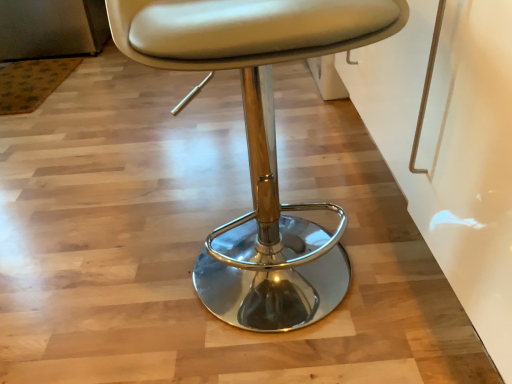
Measure the distance between beige leather stool at center and camera.

beige leather stool at center and camera are 21.07 inches apart.

The width and height of the screenshot is (512, 384). Describe the element at coordinates (259, 142) in the screenshot. I see `beige leather stool at center` at that location.

Where is `beige leather stool at center`? Image resolution: width=512 pixels, height=384 pixels. beige leather stool at center is located at coordinates (259, 142).

Locate an element on the screen. The height and width of the screenshot is (384, 512). beige leather stool at center is located at coordinates (259, 142).